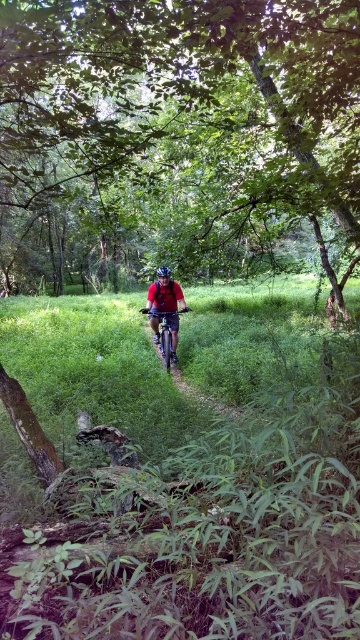
Does green leafy tree at center have a greater width compared to matte red shirt at center?

Correct, the width of green leafy tree at center exceeds that of matte red shirt at center.

Who is more forward, (131, 230) or (156, 300)?

Point (156, 300) is in front.

You are a GUI agent. You are given a task and a screenshot of the screen. Output one action in this format:
    pyautogui.click(x=<x>, y=<y>)
    Task: Click on the green leafy tree at center
    
    Given the screenshot: What is the action you would take?
    click(176, 138)

Does green leafy tree at center have a smaller size compared to blue matte helmet at center?

Incorrect, green leafy tree at center is not smaller in size than blue matte helmet at center.

Which is more to the right, green leafy tree at center or blue matte helmet at center?

blue matte helmet at center

Image resolution: width=360 pixels, height=640 pixels. What do you see at coordinates (176, 138) in the screenshot?
I see `green leafy tree at center` at bounding box center [176, 138].

The height and width of the screenshot is (640, 360). Find the location of `green leafy tree at center`. green leafy tree at center is located at coordinates (176, 138).

Does green leafy tree at center have a greater height compared to metallic silver bicycle at center?

Yes, green leafy tree at center is taller than metallic silver bicycle at center.

Does green leafy tree at center appear under metallic silver bicycle at center?

No, green leafy tree at center is not below metallic silver bicycle at center.

Does point (335, 170) lie in front of point (138, 310)?

Yes, it is in front of point (138, 310).

The width and height of the screenshot is (360, 640). I want to click on green leafy tree at center, so click(176, 138).